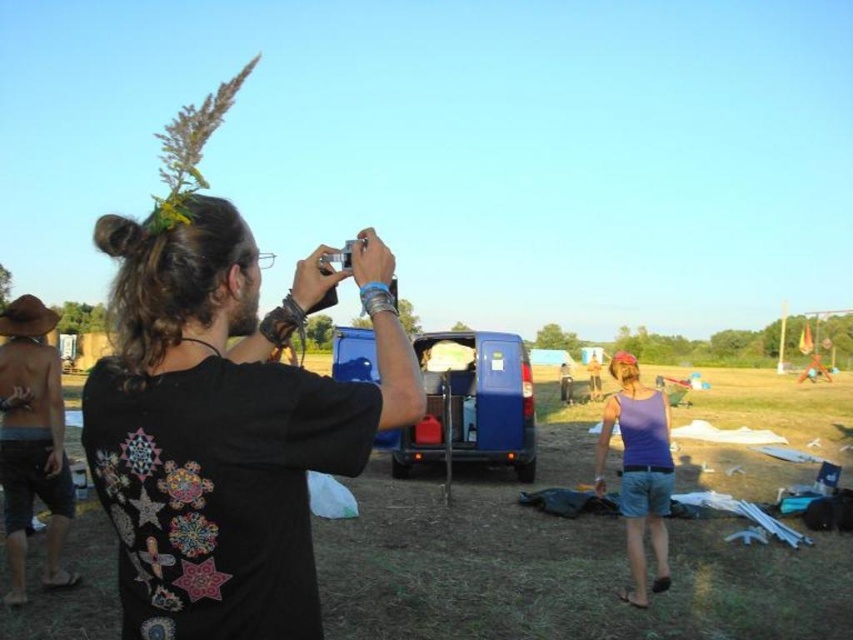
Does brown straw hat at left have a greater height compared to purple cotton tank top at lower right?

Correct, brown straw hat at left is much taller as purple cotton tank top at lower right.

What do you see at coordinates (32, 442) in the screenshot? I see `brown straw hat at left` at bounding box center [32, 442].

In order to click on brown straw hat at left in this screenshot , I will do `click(32, 442)`.

Can you confirm if black matte t-shirt at center is wider than brown straw hat at left?

Yes, black matte t-shirt at center is wider than brown straw hat at left.

Is black matte t-shirt at center bigger than brown straw hat at left?

No.

The width and height of the screenshot is (853, 640). What do you see at coordinates (225, 426) in the screenshot?
I see `black matte t-shirt at center` at bounding box center [225, 426].

Identify the location of black matte t-shirt at center. (225, 426).

Which is below, black matte t-shirt at center or purple cotton tank top at lower right?

purple cotton tank top at lower right is below.

In the scene shown: Can you confirm if black matte t-shirt at center is smaller than purple cotton tank top at lower right?

Yes.

This screenshot has height=640, width=853. Find the location of `black matte t-shirt at center`. black matte t-shirt at center is located at coordinates (225, 426).

Locate an element on the screen. This screenshot has width=853, height=640. black matte t-shirt at center is located at coordinates (225, 426).